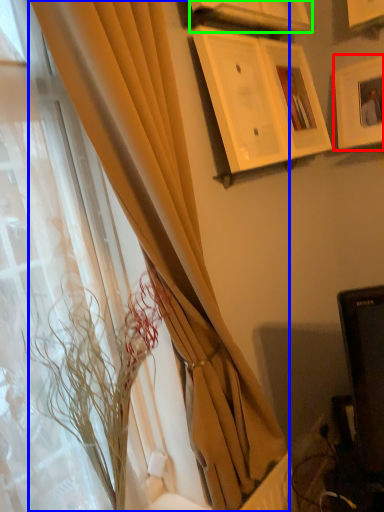
Question: Estimate the real-world distances between objects in this image. Which object is closer to picture frame (highlighted by a red box), curtain (highlighted by a blue box) or picture frame (highlighted by a green box)?

Choices:
 (A) curtain
 (B) picture frame

Answer: (B)